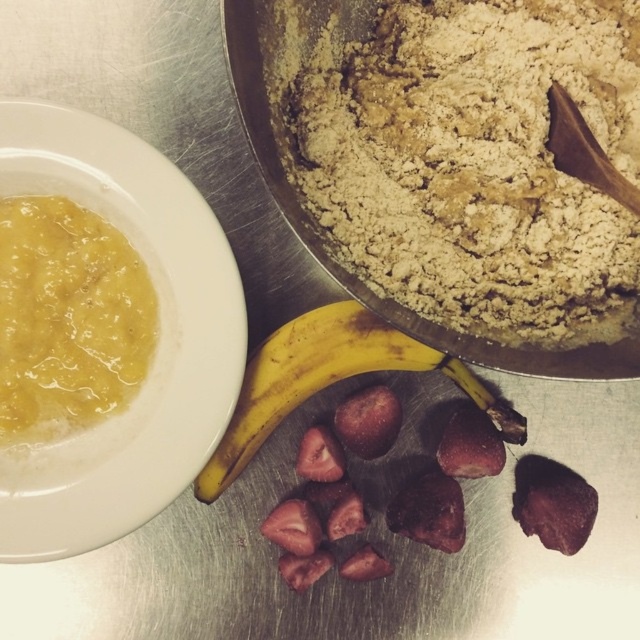
Is point (20, 465) positioned behind point (516, 472)?

No, it is not.

Looking at this image, between matte white bowl at upper left and dark brown textured strawberry at lower center, which one appears on the right side from the viewer's perspective?

dark brown textured strawberry at lower center is more to the right.

This screenshot has height=640, width=640. What do you see at coordinates (156, 346) in the screenshot?
I see `matte white bowl at upper left` at bounding box center [156, 346].

In order to click on matte white bowl at upper left in this screenshot , I will do [156, 346].

In the scene shown: Who is positioned more to the left, dry brown flour at upper right or dark brown textured strawberry at lower center?

dry brown flour at upper right is more to the left.

Does dry brown flour at upper right lie behind dark brown textured strawberry at lower center?

No, it is not.

The image size is (640, 640). Find the location of `dry brown flour at upper right`. dry brown flour at upper right is located at coordinates (470, 161).

Which of these two, dark brown textured strawberry at lower center or purple matte strawberry at center, stands shorter?

purple matte strawberry at center is shorter.

This screenshot has height=640, width=640. What do you see at coordinates (552, 502) in the screenshot?
I see `dark brown textured strawberry at lower center` at bounding box center [552, 502].

Between point (545, 508) and point (378, 392), which one is positioned behind?

The point (378, 392) is behind.

I want to click on dark brown textured strawberry at lower center, so point(552,502).